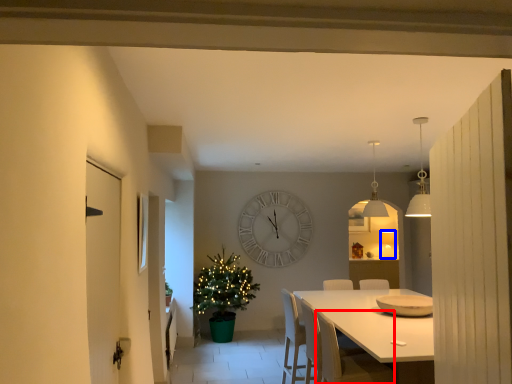
Question: Which of the following is the closest to the observer, armchair (highlighted by a red box) or lamp (highlighted by a blue box)?

Choices:
 (A) armchair
 (B) lamp

Answer: (A)